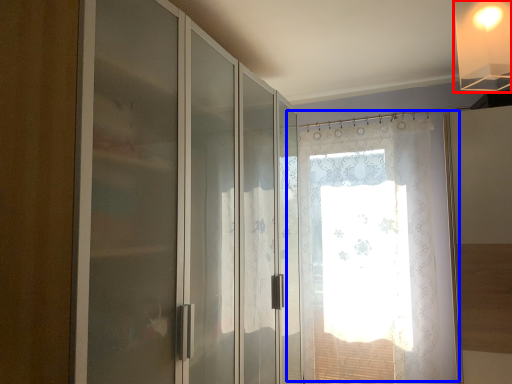
Question: Which object is closer to the camera taking this photo, light fixture (highlighted by a red box) or window (highlighted by a blue box)?

Choices:
 (A) light fixture
 (B) window

Answer: (A)